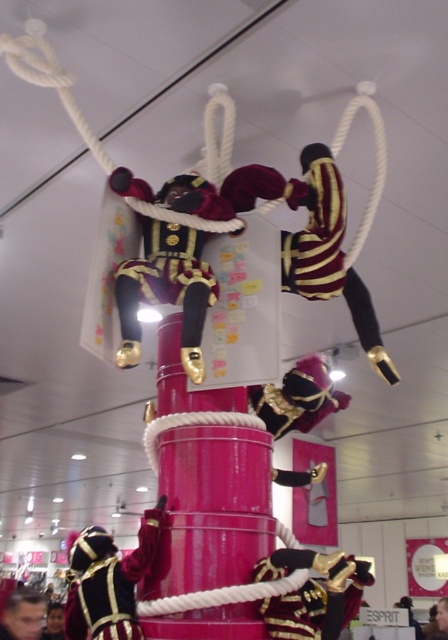
Question: Which object is farther from the camera taking this photo?

Choices:
 (A) striped velvet pants at center
 (B) shiny gold uniform at center
 (C) velvet gold uniform at lower left
 (D) smooth skin face at lower left

Answer: (D)

Question: Is striped velvet pants at center smaller than velvet gold uniform at lower left?

Choices:
 (A) yes
 (B) no

Answer: (B)

Question: Among these objects, which one is nearest to the camera?

Choices:
 (A) smooth skin face at lower left
 (B) velvet gold uniform at lower left
 (C) striped velvet pants at center
 (D) shiny gold uniform at center

Answer: (B)

Question: Estimate the real-world distances between objects in this image. Which object is closer to the velvet gold uniform at lower left?

Choices:
 (A) striped velvet pants at center
 (B) shiny gold uniform at center

Answer: (B)

Question: Does shiny gold uniform at center lie behind striped velvet pants at center?

Choices:
 (A) no
 (B) yes

Answer: (A)

Question: Can you confirm if velvet gold uniform at lower left is wider than smooth skin face at lower left?

Choices:
 (A) yes
 (B) no

Answer: (B)